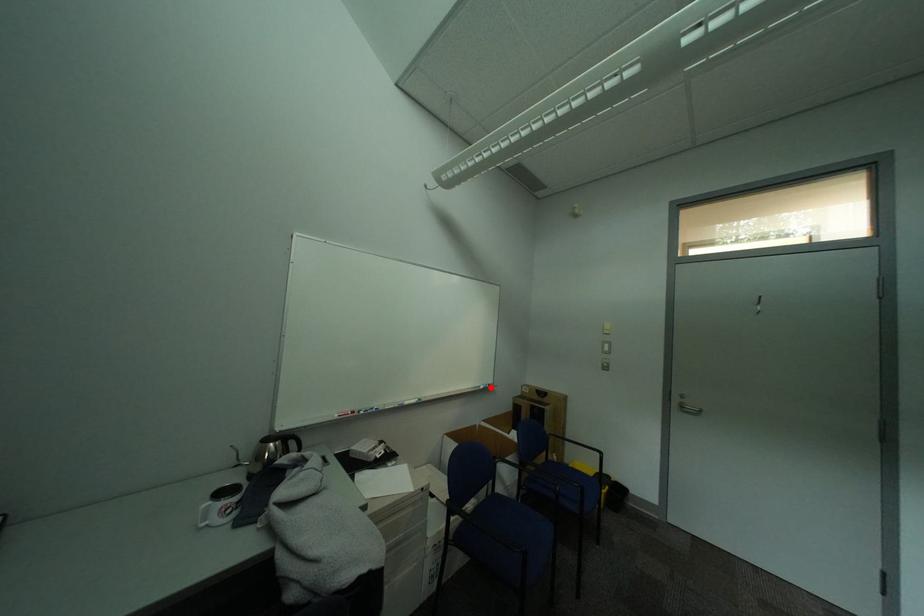
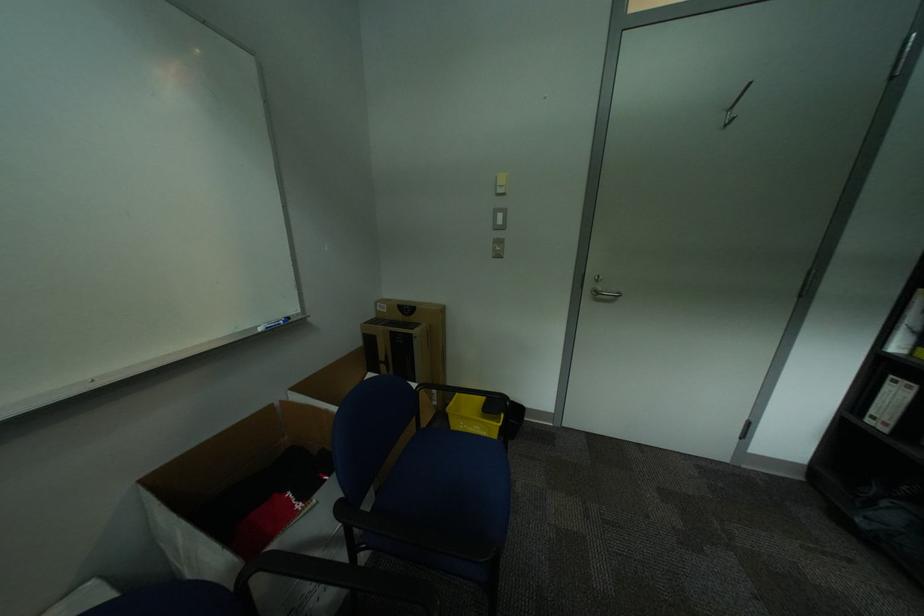
In the second image, find the point that corresponds to the highlighted location in the first image.

(266, 329)